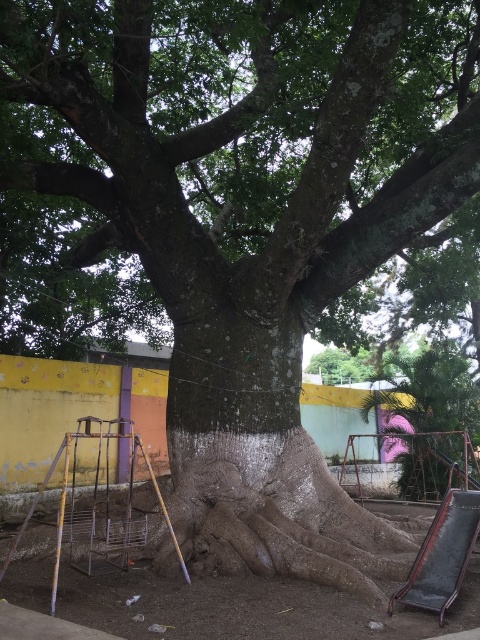
Between green rough textured tree at center and metallic silver ladder at lower left, which one has more height?

With more height is green rough textured tree at center.

Is point (434, 448) more distant than point (105, 476)?

Yes.

Where is `green rough textured tree at center`? The image size is (480, 640). green rough textured tree at center is located at coordinates (432, 392).

Locate an element on the screen. This screenshot has width=480, height=640. green rough textured tree at center is located at coordinates (432, 392).